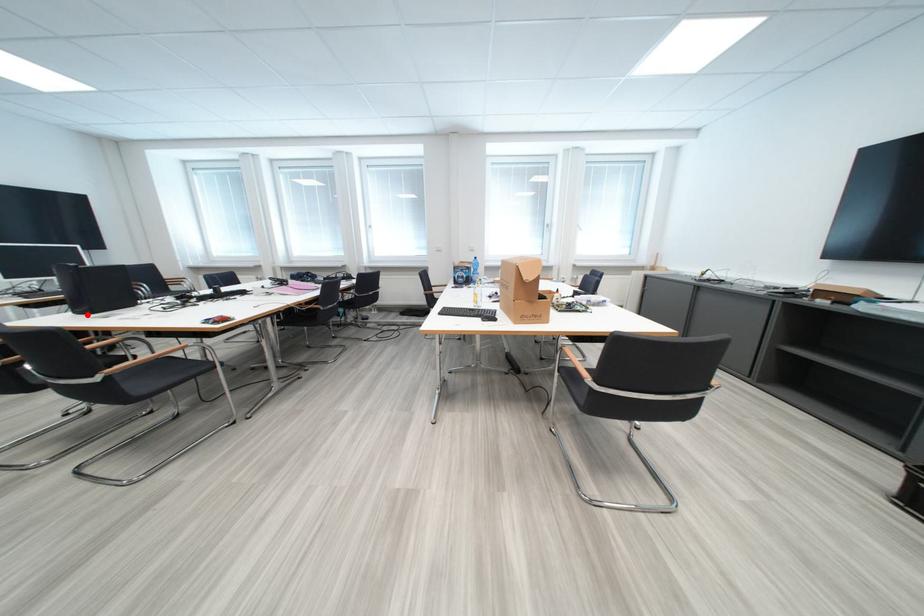
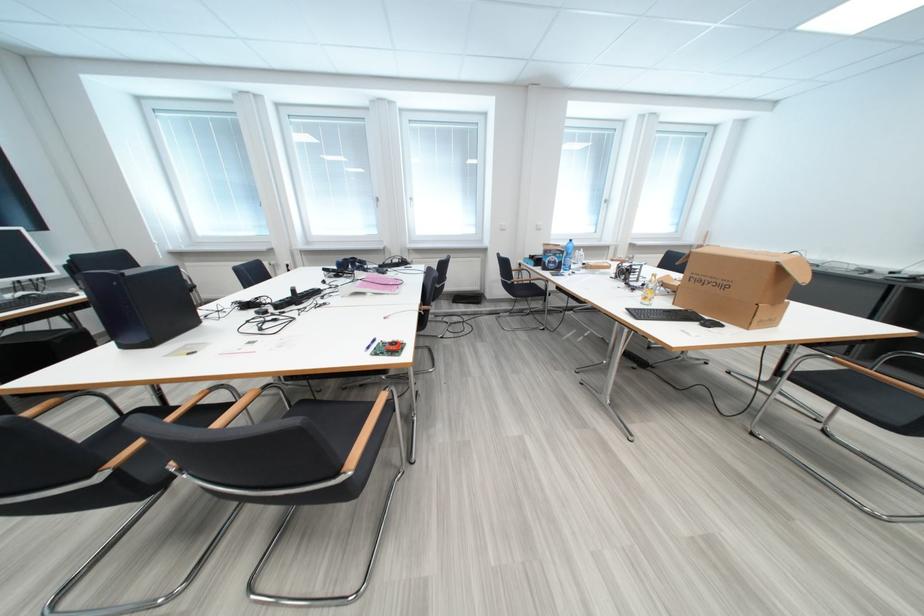
Question: I am providing you with two images of the same scene from different viewpoints. In image1, a red point is highlighted. Considering the same 3D point in image2, which of the following is correct?

Choices:
 (A) It is closer
 (B) It is farther

Answer: (B)